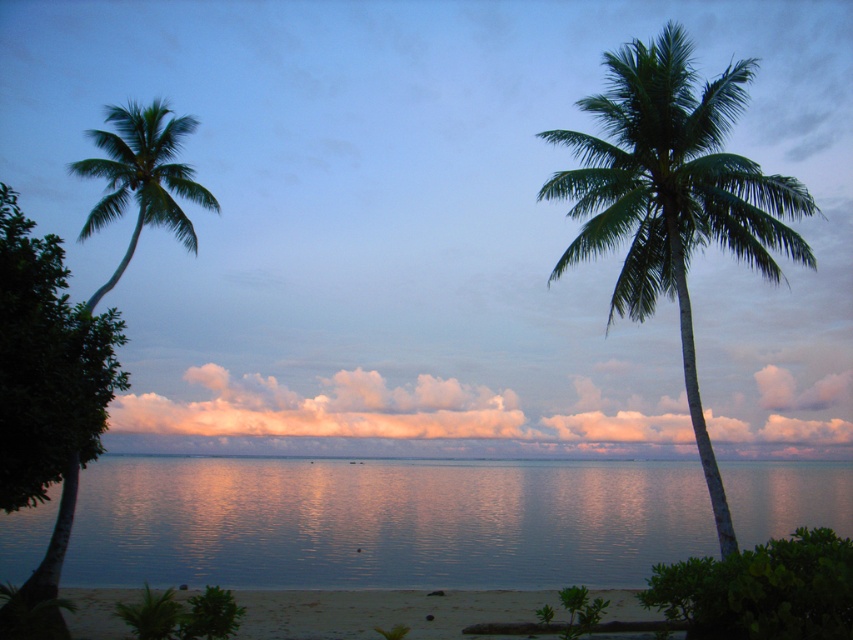
Is point (236, 513) positioned after point (337, 600)?

Yes, it is.

Is smooth blue water at center positioned at the back of sandy beach at lower center?

Yes.

Is point (115, 506) positioned behind point (564, 618)?

That is True.

Image resolution: width=853 pixels, height=640 pixels. Find the location of `smooth blue water at center`. smooth blue water at center is located at coordinates (383, 522).

Can you confirm if green leafy palm tree at right is thinner than sandy beach at lower center?

Yes, green leafy palm tree at right is thinner than sandy beach at lower center.

Which of these two, green leafy palm tree at right or sandy beach at lower center, stands taller?

green leafy palm tree at right is taller.

Where is `green leafy palm tree at right`? This screenshot has width=853, height=640. green leafy palm tree at right is located at coordinates (672, 196).

Does smooth blue water at center appear over green leafy palm tree at left?

Answer: No, smooth blue water at center is not above green leafy palm tree at left.

This screenshot has width=853, height=640. Find the location of `smooth blue water at center`. smooth blue water at center is located at coordinates (383, 522).

Identify the location of smooth blue water at center. The height and width of the screenshot is (640, 853). (383, 522).